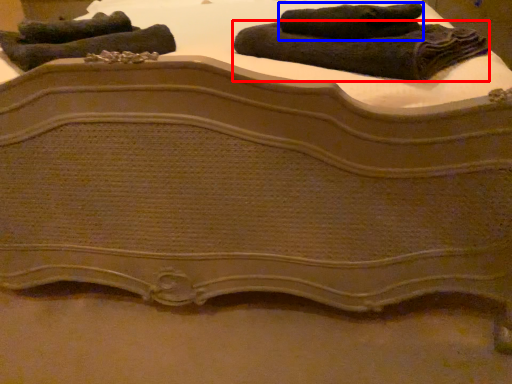
Question: Which object is closer to the camera taking this photo, towel (highlighted by a red box) or towel (highlighted by a blue box)?

Choices:
 (A) towel
 (B) towel

Answer: (A)